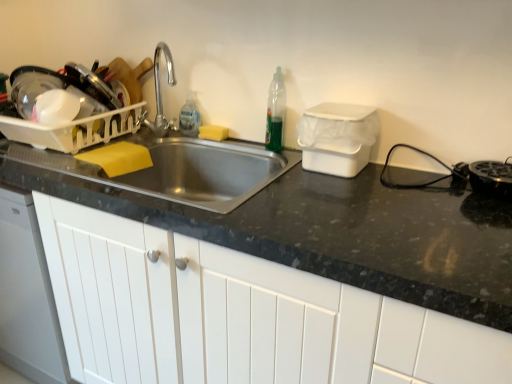
In order to click on free location in front of black plastic toaster at right, the 1th appliance from the right in this screenshot , I will do `click(490, 223)`.